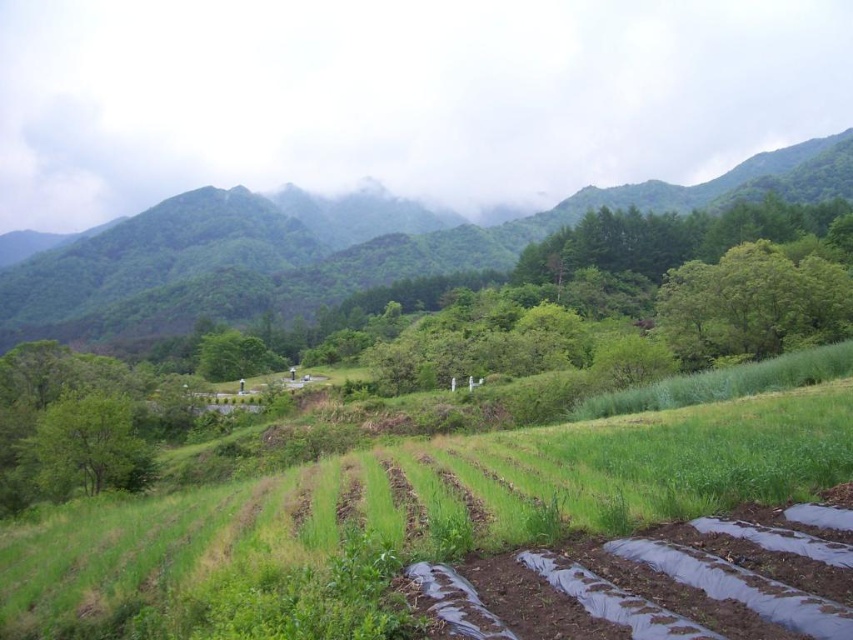
Question: Can you confirm if green leafy tree at left is positioned to the left of green leafy tree at center?

Choices:
 (A) yes
 (B) no

Answer: (B)

Question: Is green leafy tree at center-right above green leafy tree at left?

Choices:
 (A) yes
 (B) no

Answer: (A)

Question: From the image, what is the correct spatial relationship of green grass at center in relation to green leafy tree at center?

Choices:
 (A) right
 (B) left

Answer: (A)

Question: Which point is farther to the camera?

Choices:
 (A) green leafy tree at left
 (B) green grassy hillside at upper center
 (C) green leafy tree at center

Answer: (B)

Question: Which point appears farthest from the camera in this image?

Choices:
 (A) (146, 465)
 (B) (587, 618)
 (C) (671, 314)
 (D) (215, 368)

Answer: (D)

Question: Which object appears closest to the camera in this image?

Choices:
 (A) green leafy tree at center
 (B) green grassy hillside at upper center
 (C) green leafy tree at left
 (D) green leafy tree at center-right

Answer: (C)